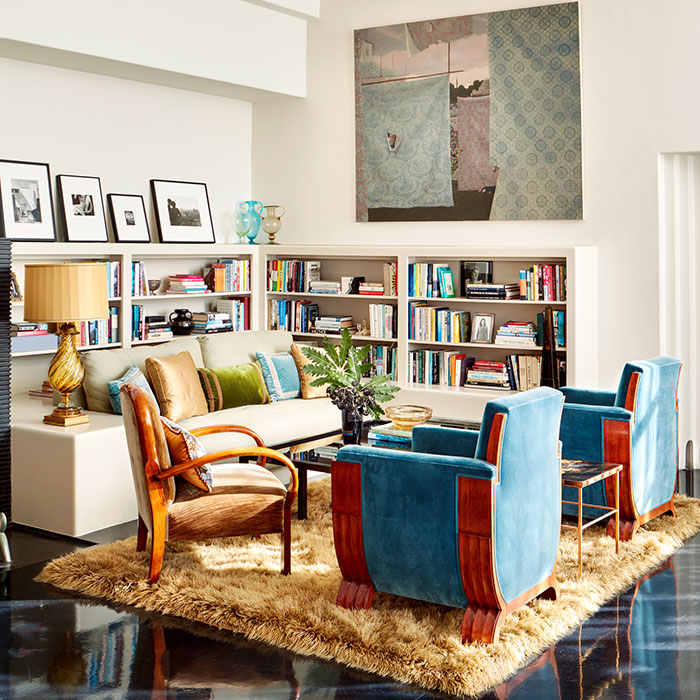
This screenshot has height=700, width=700. In order to click on lamp shade in this screenshot , I will do `click(73, 295)`.